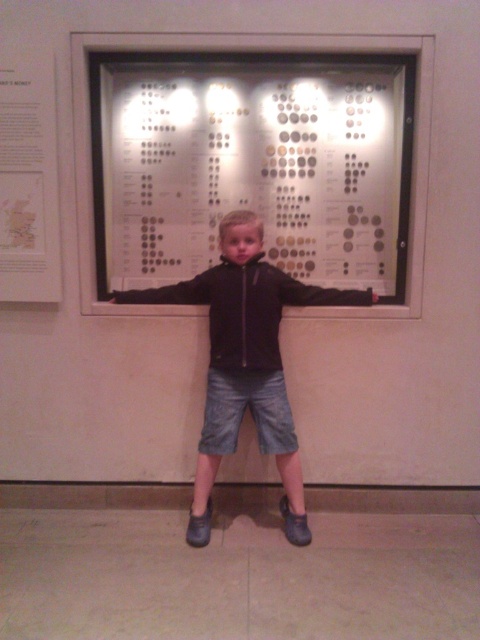
You are a photographer trying to capture the child in the image. You need to position your camera so that the black matte arm at center and the black leather arm at center are both visible in the frame. Which arm should be placed on the right side of the camera frame to ensure both are visible?

The black matte arm at center should be placed on the right side of the camera frame because it is located to the right of the black leather arm at center in the scene.